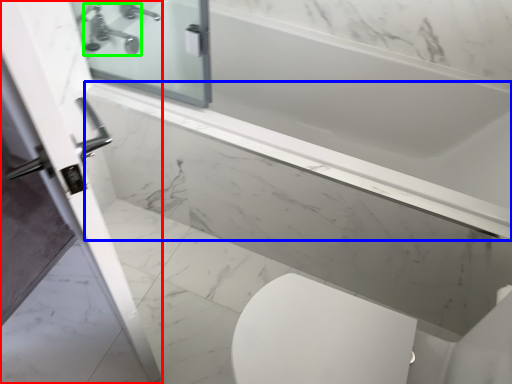
Question: Which is farther away from screen door (highlighted by a red box)? ledge (highlighted by a blue box) or tap (highlighted by a green box)?

Choices:
 (A) ledge
 (B) tap

Answer: (B)